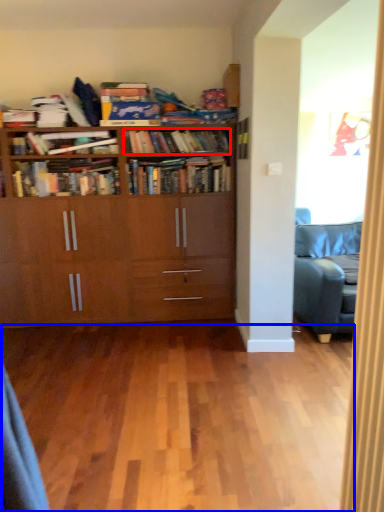
Question: Which point is closer to the camera, book (highlighted by a red box) or plain (highlighted by a blue box)?

Choices:
 (A) book
 (B) plain

Answer: (B)